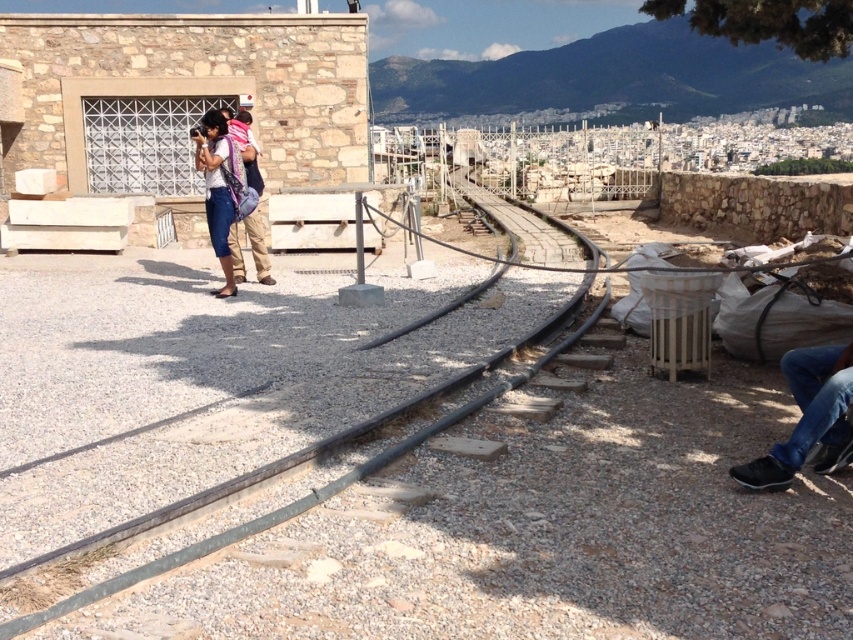
Who is more forward, (575, 268) or (792, 433)?

Point (792, 433)

Is point (531, 209) positioned after point (740, 467)?

That is True.

The height and width of the screenshot is (640, 853). What do you see at coordinates (289, 502) in the screenshot?
I see `black rubber train track at center` at bounding box center [289, 502].

You are a GUI agent. You are given a task and a screenshot of the screen. Output one action in this format:
    pyautogui.click(x=<x>, y=<y>)
    Task: Click on the black rubber train track at center
    The image size is (853, 640).
    Given the screenshot: What is the action you would take?
    pyautogui.click(x=289, y=502)

Does black leather shoes at lower right come in front of matte blue pants at center?

Yes, it is.

Between point (786, 477) and point (206, 112), which one is positioned behind?

Point (206, 112)

Where is `black leather shoes at lower right`? This screenshot has width=853, height=640. black leather shoes at lower right is located at coordinates (808, 417).

Between black rubber train track at center and matte blue pants at center, which one is positioned lower?

matte blue pants at center is lower down.

Is black rubber train track at center below matte blue pants at center?

No.

Between point (67, 547) and point (219, 253), which one is positioned in front?

Point (67, 547) is more forward.

The height and width of the screenshot is (640, 853). I want to click on black rubber train track at center, so click(x=289, y=502).